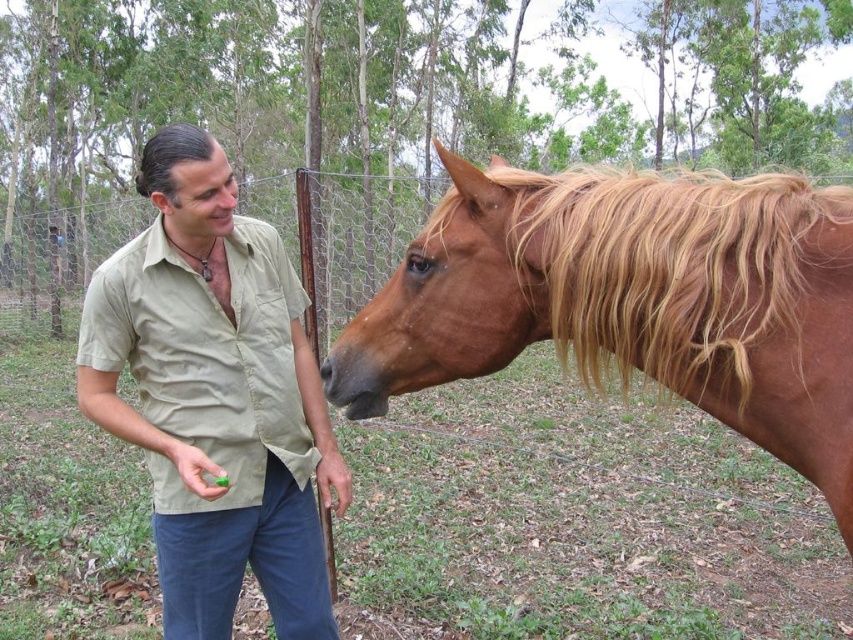
Question: Estimate the real-world distances between objects in this image. Which object is closer to the golden silky mane at upper right?

Choices:
 (A) brown glossy horse at right
 (B) matte khaki shirt at center

Answer: (A)

Question: Which is nearer to the golden silky mane at upper right?

Choices:
 (A) matte khaki shirt at center
 (B) brown glossy horse at right

Answer: (B)

Question: Is brown glossy horse at right thinner than golden silky mane at upper right?

Choices:
 (A) no
 (B) yes

Answer: (A)

Question: Which object is positioned farthest from the golden silky mane at upper right?

Choices:
 (A) matte khaki shirt at center
 (B) brown glossy horse at right

Answer: (A)

Question: Is matte khaki shirt at center below golden silky mane at upper right?

Choices:
 (A) yes
 (B) no

Answer: (A)

Question: Can you confirm if brown glossy horse at right is positioned to the left of matte khaki shirt at center?

Choices:
 (A) yes
 (B) no

Answer: (B)